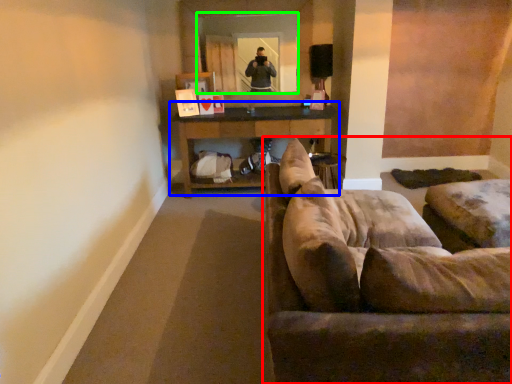
Question: Which object is the farthest from studio couch (highlighted by a red box)? Choose among these: table (highlighted by a blue box) or mirror (highlighted by a green box).

Choices:
 (A) table
 (B) mirror

Answer: (B)